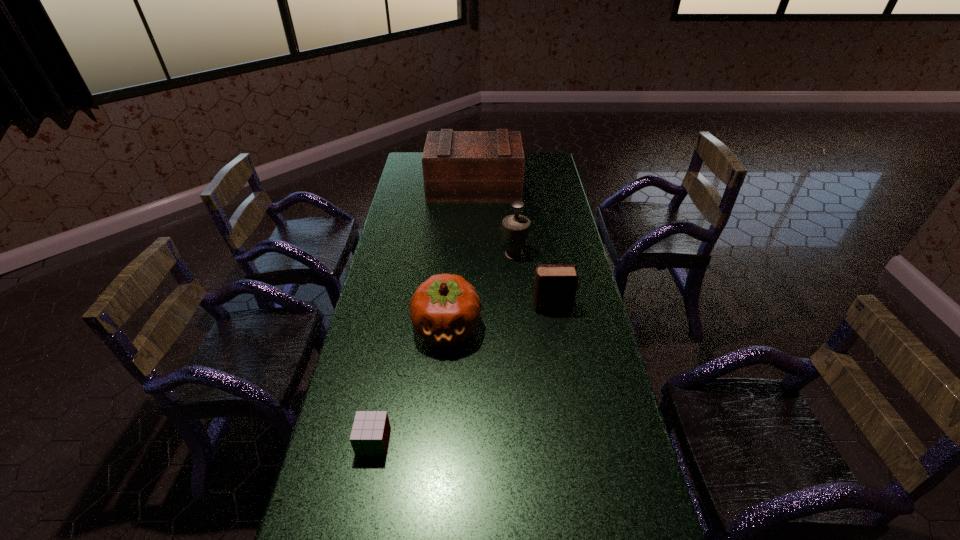
I want to click on free space located on the spine side of the fourth tallest object, so click(x=460, y=307).

Where is `vacant space located 0.110m on the spine side of the fourth tallest object`? vacant space located 0.110m on the spine side of the fourth tallest object is located at coordinates (500, 307).

The height and width of the screenshot is (540, 960). I want to click on blank space located 0.330m on the right of the cube, so click(513, 442).

Image resolution: width=960 pixels, height=540 pixels. Identify the location of box located at the left edge. (458, 166).

You are a GUI agent. You are given a task and a screenshot of the screen. Output one action in this format:
    pyautogui.click(x=<x>, y=<y>)
    Task: Click on the cube that is at the left edge
    Image resolution: width=960 pixels, height=540 pixels.
    Given the screenshot: What is the action you would take?
    pyautogui.click(x=370, y=433)

Where is `object that is at the right edge`? Image resolution: width=960 pixels, height=540 pixels. object that is at the right edge is located at coordinates (555, 286).

Image resolution: width=960 pixels, height=540 pixels. I want to click on free space at the left edge of the desktop, so click(407, 226).

Locate an element on the screen. The height and width of the screenshot is (540, 960). vacant space at the right edge of the desktop is located at coordinates (601, 472).

This screenshot has height=540, width=960. Find the location of `vacant space that's between the second shortest object and the pumpkin`. vacant space that's between the second shortest object and the pumpkin is located at coordinates (499, 318).

Identify the location of free area in between the fourth tallest object and the urn. The height and width of the screenshot is (540, 960). (533, 281).